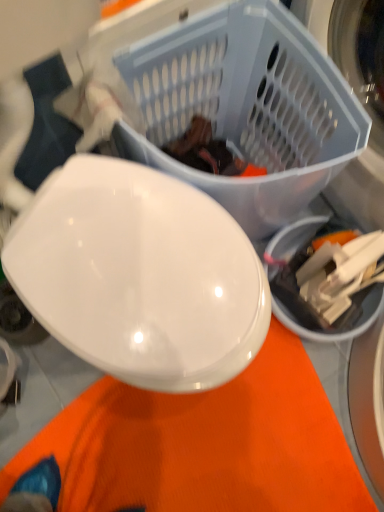
What do you see at coordinates (246, 106) in the screenshot?
I see `matte plastic laundry basket at upper center` at bounding box center [246, 106].

Identify the location of matte plastic laundry basket at upper center. (246, 106).

Describe the element at coordinates (208, 152) in the screenshot. I see `dark brown fabric at center` at that location.

Identify the location of dark brown fabric at center. This screenshot has width=384, height=512. (208, 152).

Identify the location of matte plastic laundry basket at upper center. (246, 106).

Would you say dark brown fabric at center is to the left or to the right of matte plastic laundry basket at upper center in the picture?

In the image, dark brown fabric at center appears on the left side of matte plastic laundry basket at upper center.

Who is more distant, dark brown fabric at center or matte plastic laundry basket at upper center?

Positioned behind is dark brown fabric at center.

Which point is more distant from viewer, (228, 156) or (289, 198)?

The point (228, 156) is more distant.

From the image's perspective, would you say dark brown fabric at center is positioned over matte plastic laundry basket at upper center?

Indeed, from the image's perspective, dark brown fabric at center is shown above matte plastic laundry basket at upper center.

Looking at this image, from a real-world perspective, who is located lower, dark brown fabric at center or matte plastic laundry basket at upper center?

dark brown fabric at center, from a real-world perspective.

Considering the sizes of objects dark brown fabric at center and matte plastic laundry basket at upper center in the image provided, who is wider, dark brown fabric at center or matte plastic laundry basket at upper center?

matte plastic laundry basket at upper center is wider.

Between dark brown fabric at center and matte plastic laundry basket at upper center, which one has less height?

Standing shorter between the two is dark brown fabric at center.

Considering the relative sizes of dark brown fabric at center and matte plastic laundry basket at upper center in the image provided, is dark brown fabric at center bigger than matte plastic laundry basket at upper center?

Incorrect, dark brown fabric at center is not larger than matte plastic laundry basket at upper center.

Is dark brown fabric at center located outside matte plastic laundry basket at upper center?

No, dark brown fabric at center is inside matte plastic laundry basket at upper center's boundary.

Is dark brown fabric at center placed right next to matte plastic laundry basket at upper center?

No, dark brown fabric at center is not next to matte plastic laundry basket at upper center.

Could you tell me if dark brown fabric at center is facing matte plastic laundry basket at upper center?

Yes, dark brown fabric at center is oriented towards matte plastic laundry basket at upper center.

This screenshot has height=512, width=384. Find the location of `food on the left of matte plastic laundry basket at upper center`. food on the left of matte plastic laundry basket at upper center is located at coordinates (208, 152).

Can you confirm if matte plastic laundry basket at upper center is positioned to the right of dark brown fabric at center?

Yes.

Considering the relative positions of matte plastic laundry basket at upper center and dark brown fabric at center in the image provided, is matte plastic laundry basket at upper center behind dark brown fabric at center?

That is False.

In the scene shown: Which point is more forward, [231,192] or [215,145]?

Point [231,192]

From the image's perspective, between matte plastic laundry basket at upper center and dark brown fabric at center, who is located below?

matte plastic laundry basket at upper center is shown below in the image.

From a real-world perspective, is matte plastic laundry basket at upper center beneath dark brown fabric at center?

Incorrect, from a real-world perspective, matte plastic laundry basket at upper center is higher than dark brown fabric at center.

Can you confirm if matte plastic laundry basket at upper center is wider than dark brown fabric at center?

Yes, matte plastic laundry basket at upper center is wider than dark brown fabric at center.

Between matte plastic laundry basket at upper center and dark brown fabric at center, which one has less height?

dark brown fabric at center.

Considering the relative sizes of matte plastic laundry basket at upper center and dark brown fabric at center in the image provided, is matte plastic laundry basket at upper center bigger than dark brown fabric at center?

Yes.

From the picture: Is dark brown fabric at center located within matte plastic laundry basket at upper center?

Yes, dark brown fabric at center is inside matte plastic laundry basket at upper center.

Are matte plastic laundry basket at upper center and dark brown fabric at center far apart?

No.

Could you tell me if matte plastic laundry basket at upper center is turned towards dark brown fabric at center?

Yes, matte plastic laundry basket at upper center faces towards dark brown fabric at center.

What's the angular difference between matte plastic laundry basket at upper center and dark brown fabric at center's facing directions?

The angle between the facing direction of matte plastic laundry basket at upper center and the facing direction of dark brown fabric at center is 0.966 degrees.

Measure the distance from matte plastic laundry basket at upper center to dark brown fabric at center.

matte plastic laundry basket at upper center is 5.39 inches from dark brown fabric at center.

Identify the location of food located above the matte plastic laundry basket at upper center (from the image's perspective). (208, 152).

Locate an element on the screen. The width and height of the screenshot is (384, 512). food behind the matte plastic laundry basket at upper center is located at coordinates (208, 152).

At what (x,y) coordinates should I click in order to perform the action: click on basket that appears above the dark brown fabric at center (from a real-world perspective). Please return your answer as a coordinate pair (x, y). This screenshot has width=384, height=512. Looking at the image, I should click on (246, 106).